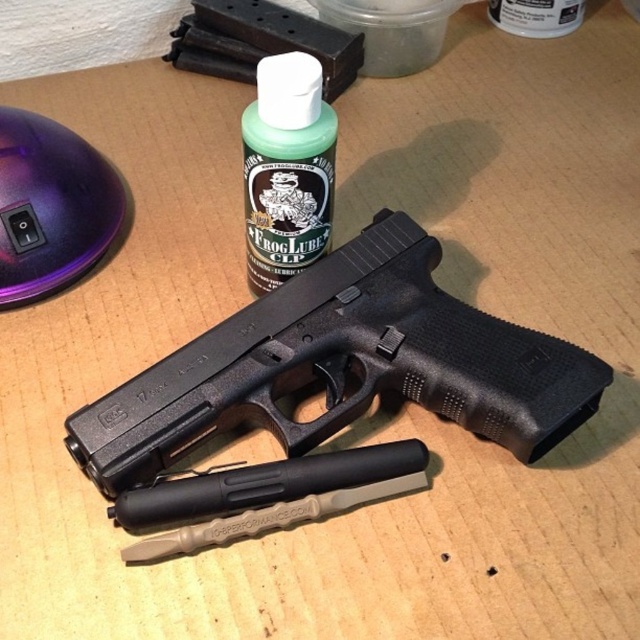
You are a security guard checking the items on a table. You need to place the black matte handgun at center and the purple glossy mouse at upper left into a storage container. The container has a width of 10 cm. If the handgun is wider than the mouse, will both items fit side by side?

The black matte handgun at center might be wider than purple glossy mouse at upper left. If the handgun is indeed wider, placing both items side by side in a 10 cm width container may not be possible as the handgun alone could exceed the container width.

You are a photographer setting up a closeup shot of the scene described. You have two points marked in the image at coordinates point (x=97, y=179) and point (x=272, y=188). Which point should you focus on if you want the foreground object to be sharp while the background is blurred?

You should focus on point (x=97, y=179) because it is closer to the camera than point (x=272, y=188), so focusing there will keep the foreground sharp and blur the background.

What object is located at the coordinates point (x=344, y=365) in the image?

The object at point (x=344, y=365) is the black matte handgun at center.